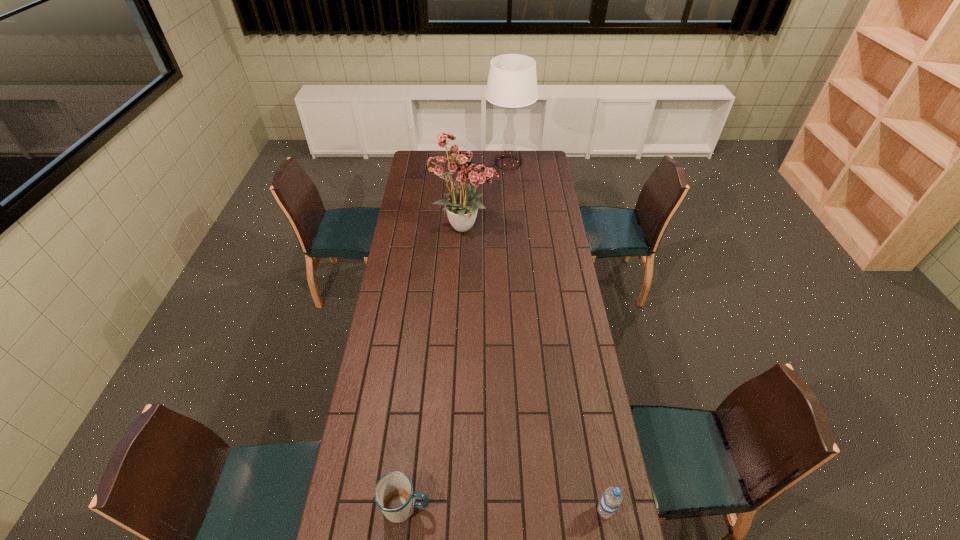
This screenshot has width=960, height=540. In order to click on object that stands as the closest to the table lamp in this screenshot , I will do `click(460, 168)`.

The width and height of the screenshot is (960, 540). I want to click on vacant position in the image that satisfies the following two spatial constraints: 1. on the front-facing side of the farthest object; 2. on the front-facing side of the flower arrangement, so click(514, 226).

Identify the location of vacant position in the image that satisfies the following two spatial constraints: 1. on the front-facing side of the table lamp; 2. on the front-facing side of the flower arrangement. Image resolution: width=960 pixels, height=540 pixels. (514, 226).

I want to click on vacant space that satisfies the following two spatial constraints: 1. on the front-facing side of the farthest object; 2. on the handle side of the mug, so click(536, 506).

Locate an element on the screen. This screenshot has height=540, width=960. free space that satisfies the following two spatial constraints: 1. on the front-facing side of the farthest object; 2. on the front-facing side of the third nearest object is located at coordinates pyautogui.click(x=514, y=226).

Identify the location of free point that satisfies the following two spatial constraints: 1. on the front-facing side of the farthest object; 2. on the handle side of the mug. This screenshot has width=960, height=540. (536, 506).